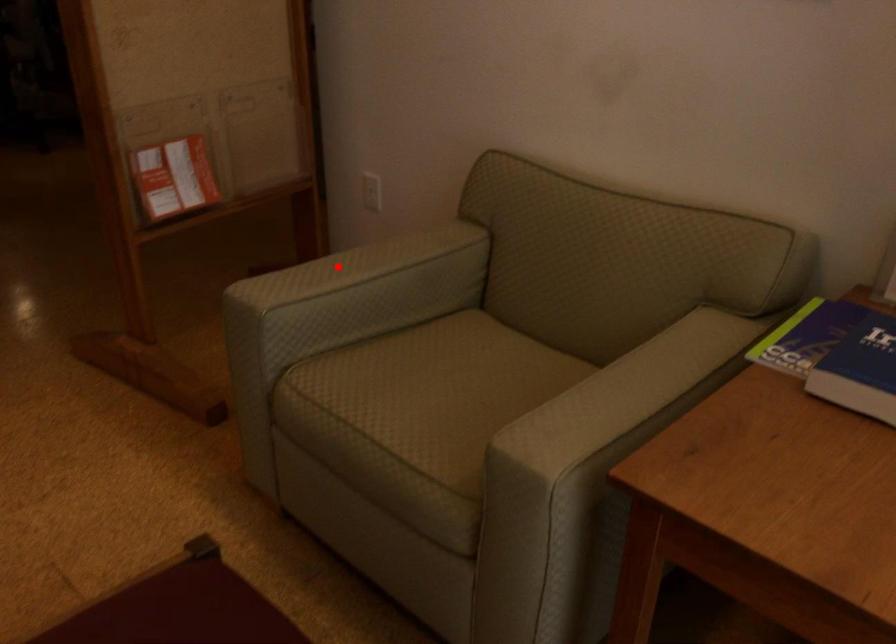
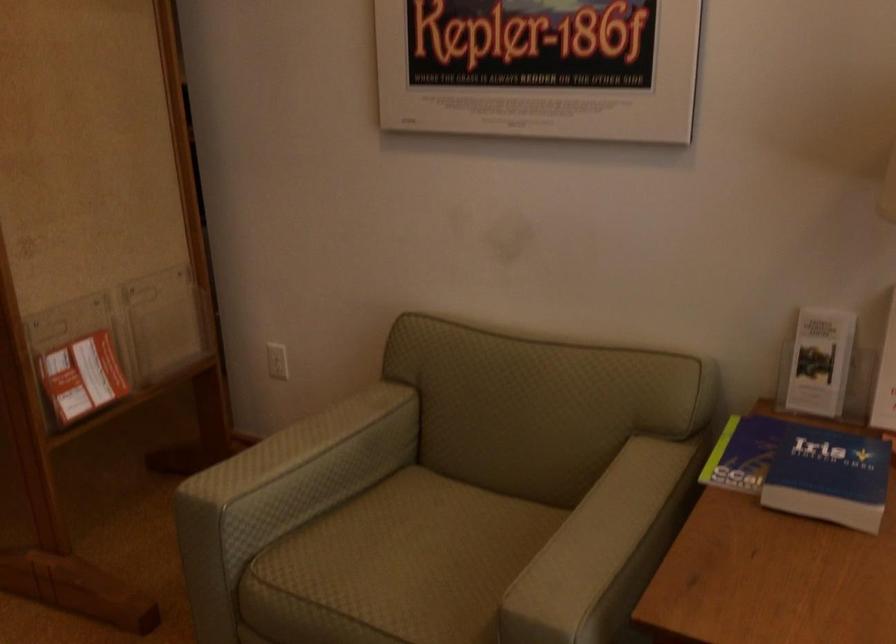
In the second image, find the point that corresponds to the highlighted location in the first image.

(286, 449)